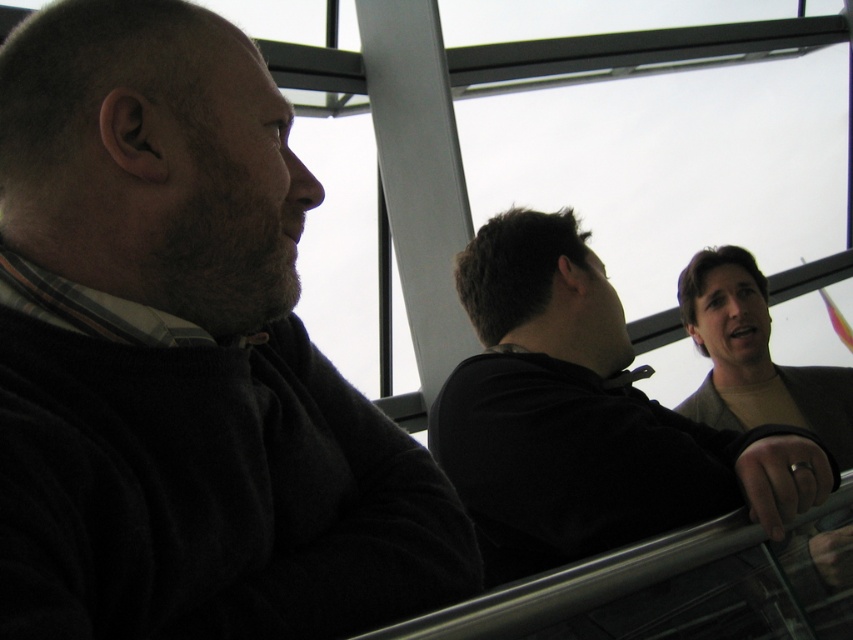
You are standing at the center of the image and want to locate the dark gray hoodie at upper right. According to the coordinates provided, in which direction should you look to find it?

The dark gray hoodie at upper right is located at point 0.653 on the x axis and 0.687 on the y axis. Since the coordinates are both above 0.5, you should look towards the upper right direction to find it.

You are an airport security officer checking the width of clothing items for a new luggage policy. You observe the dark gray hoodie at upper right and the matte brown shirt at right. Which clothing item has a smaller width?

The dark gray hoodie at upper right has a smaller width than the matte brown shirt at right according to the description.

You are standing in the scene and want to move from point A to point B. Point A is at coordinate point(320,189) and point B is at coordinate point(837,380). Which point is closer to you?

Point A at coordinate point(320,189) is closer to you than point B at coordinate point(837,380).